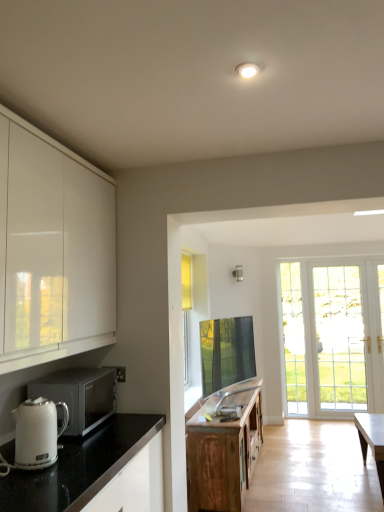
Question: From a real-world perspective, is white glossy electric kettle at lower left physically below silver metallic microwave at left?

Choices:
 (A) no
 (B) yes

Answer: (A)

Question: Is white glossy electric kettle at lower left positioned beyond the bounds of silver metallic microwave at left?

Choices:
 (A) no
 (B) yes

Answer: (B)

Question: Considering the relative sizes of white glossy electric kettle at lower left and silver metallic microwave at left in the image provided, is white glossy electric kettle at lower left shorter than silver metallic microwave at left?

Choices:
 (A) no
 (B) yes

Answer: (B)

Question: Is white glossy electric kettle at lower left behind silver metallic microwave at left?

Choices:
 (A) no
 (B) yes

Answer: (A)

Question: Is white glossy electric kettle at lower left touching silver metallic microwave at left?

Choices:
 (A) yes
 (B) no

Answer: (B)

Question: Considering the positions of white glossy electric kettle at lower left and wooden cabinet at center in the image, is white glossy electric kettle at lower left bigger or smaller than wooden cabinet at center?

Choices:
 (A) big
 (B) small

Answer: (B)

Question: Is white glossy electric kettle at lower left spatially inside wooden cabinet at center, or outside of it?

Choices:
 (A) inside
 (B) outside

Answer: (B)

Question: Is point (49, 457) positioned closer to the camera than point (231, 480)?

Choices:
 (A) farther
 (B) closer

Answer: (B)

Question: From a real-world perspective, is white glossy electric kettle at lower left above or below wooden cabinet at center?

Choices:
 (A) below
 (B) above

Answer: (B)

Question: Do you think white glossy countertop at lower left is within wooden cabinet at center, or outside of it?

Choices:
 (A) inside
 (B) outside

Answer: (B)

Question: From a real-world perspective, is white glossy countertop at lower left physically located above or below wooden cabinet at center?

Choices:
 (A) above
 (B) below

Answer: (A)

Question: Considering the positions of white glossy countertop at lower left and wooden cabinet at center in the image, is white glossy countertop at lower left bigger or smaller than wooden cabinet at center?

Choices:
 (A) small
 (B) big

Answer: (A)

Question: From the image's perspective, is white glossy countertop at lower left above or below wooden cabinet at center?

Choices:
 (A) below
 (B) above

Answer: (B)

Question: Is wooden cabinet at center taller or shorter than silver metallic microwave at left?

Choices:
 (A) tall
 (B) short

Answer: (A)

Question: Do you think wooden cabinet at center is within silver metallic microwave at left, or outside of it?

Choices:
 (A) outside
 (B) inside

Answer: (A)